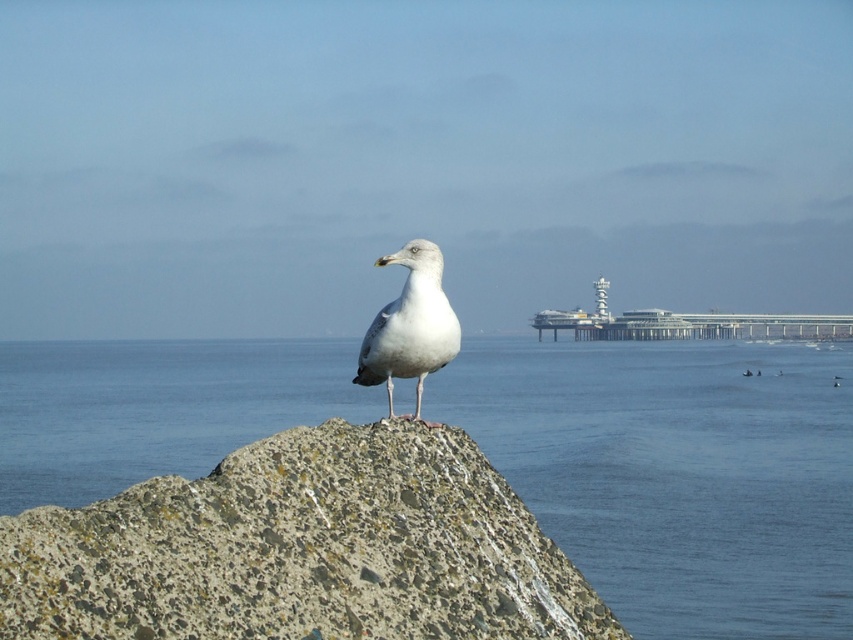
Looking at this image, you are a photographer trying to capture the white feathered bird at center and the blue water at center in a single frame. Based on their sizes, which one will occupy more space in your photo?

The blue water at center has a larger width than the white feathered bird at center, so it will occupy more space in the photo.